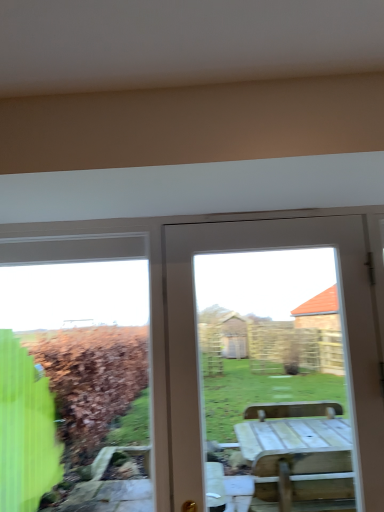
Find the location of a particular element. blank space situated above white wood door at center (from a real-world perspective) is located at coordinates (270, 216).